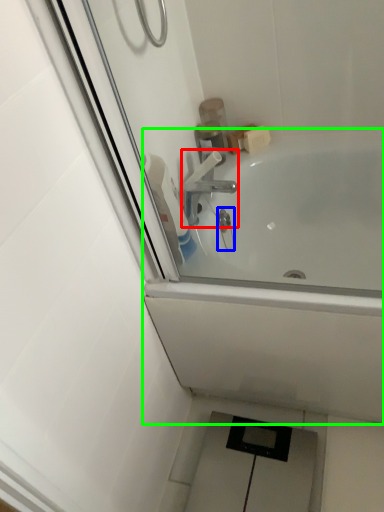
Question: Considering the real-world distances, which object is closest to tap (highlighted by a red box)? plumbing fixture (highlighted by a blue box) or bathtub (highlighted by a green box).

Choices:
 (A) plumbing fixture
 (B) bathtub

Answer: (A)